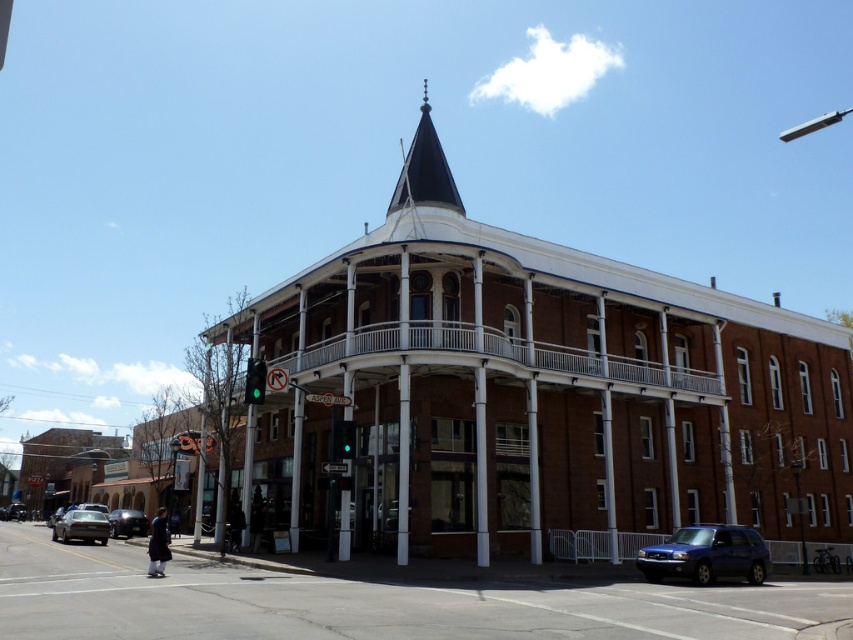
Does blue matte suv at lower right appear on the right side of green glass traffic light at upper center?

Yes, blue matte suv at lower right is to the right of green glass traffic light at upper center.

This screenshot has width=853, height=640. Find the location of `blue matte suv at lower right`. blue matte suv at lower right is located at coordinates (706, 554).

Consider the image. Can you confirm if blue matte suv at lower right is bigger than matte black sedan at lower left?

Yes, blue matte suv at lower right is bigger than matte black sedan at lower left.

Who is taller, blue matte suv at lower right or matte black sedan at lower left?

With more height is blue matte suv at lower right.

I want to click on blue matte suv at lower right, so click(x=706, y=554).

This screenshot has height=640, width=853. What are the coordinates of `metallic silver sedan at lower left` in the screenshot? It's located at (82, 525).

Who is more forward, (74, 522) or (21, 509)?

Point (74, 522) is in front.

Where is `metallic silver sedan at lower left`? The height and width of the screenshot is (640, 853). metallic silver sedan at lower left is located at coordinates (82, 525).